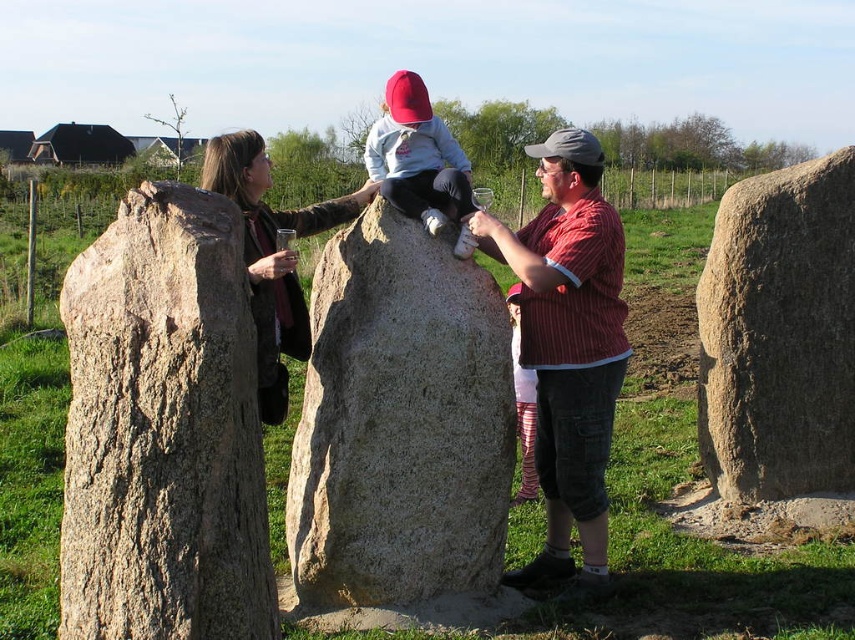
Does smooth gray rock at center have a greater width compared to matte gray hoodie at center?

Yes.

Measure the distance between smooth gray rock at center and camera.

They are 6.04 meters apart.

Locate an element on the screen. This screenshot has width=855, height=640. smooth gray rock at center is located at coordinates (779, 333).

Who is more forward, (111,493) or (550,532)?

Positioned in front is point (111,493).

Does point (171, 243) lie in front of point (585, 268)?

Yes, point (171, 243) is in front of point (585, 268).

Describe the element at coordinates (163, 429) in the screenshot. The width and height of the screenshot is (855, 640). I see `rough textured stone at left` at that location.

The height and width of the screenshot is (640, 855). Identify the location of rough textured stone at left. (163, 429).

Is granite boulder at center behind brown leather jacket at left?

Yes, granite boulder at center is behind brown leather jacket at left.

Who is more forward, (x=411, y=545) or (x=289, y=272)?

Point (x=411, y=545) is more forward.

Locate an element on the screen. granite boulder at center is located at coordinates (399, 422).